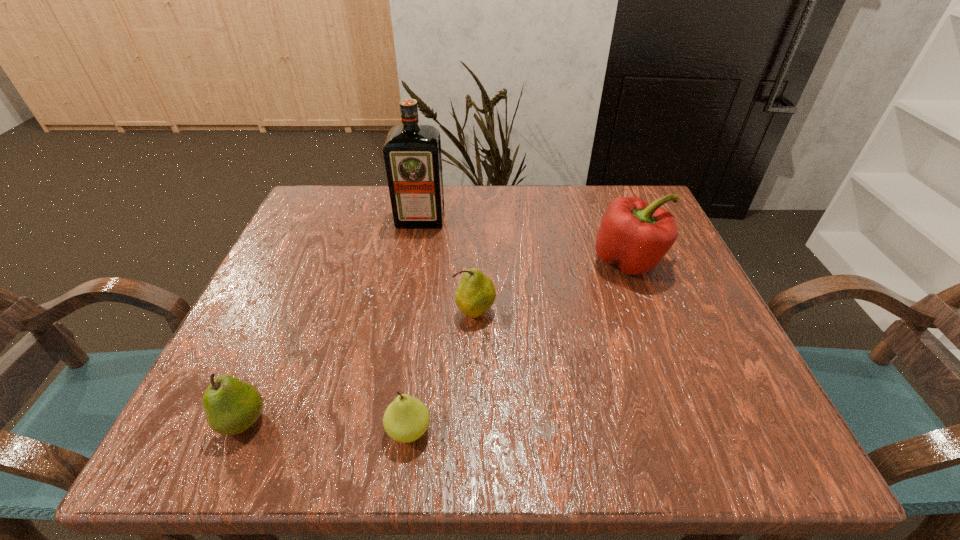
This screenshot has height=540, width=960. Identify the location of free region at the near edge of the desktop. [575, 414].

In the image, there is a desktop. Where is `vacant space at the left edge`? The image size is (960, 540). vacant space at the left edge is located at coordinates (316, 323).

Identify the location of vacant area at the right edge of the desktop. (692, 279).

Where is `free space at the far left corner`? Image resolution: width=960 pixels, height=540 pixels. free space at the far left corner is located at coordinates (369, 200).

Where is `empty space that is in between the leftmost pear and the rightmost pear`? The height and width of the screenshot is (540, 960). empty space that is in between the leftmost pear and the rightmost pear is located at coordinates (359, 366).

Identify the location of free spot between the second farthest object and the leftmost pear. This screenshot has height=540, width=960. (436, 341).

You are a GUI agent. You are given a task and a screenshot of the screen. Output one action in this format:
    pyautogui.click(x=<x>, y=<y>)
    Task: Click on the free space between the leftmost pear and the farthest object
    
    Given the screenshot: What is the action you would take?
    pyautogui.click(x=332, y=320)

Locate an element on the screen. The width and height of the screenshot is (960, 540). unoccupied position between the third nearest object and the leftmost object is located at coordinates (359, 366).

At what (x,y) coordinates should I click in order to perform the action: click on vacant area that lies between the rightmost pear and the leftmost object. Please return your answer as a coordinate pair (x, y). The height and width of the screenshot is (540, 960). Looking at the image, I should click on pos(359,366).

Where is `free point between the leftmost object and the second object from right to left`? The width and height of the screenshot is (960, 540). free point between the leftmost object and the second object from right to left is located at coordinates (359, 366).